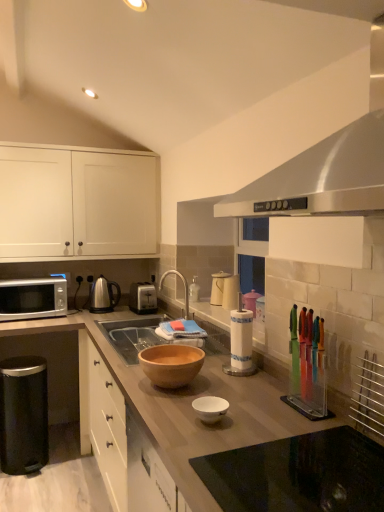
Identify the location of vacant space underneath silver metallic microwave at left, the first countertop when ordered from left to right (from a real-world perspective). The height and width of the screenshot is (512, 384). (64, 436).